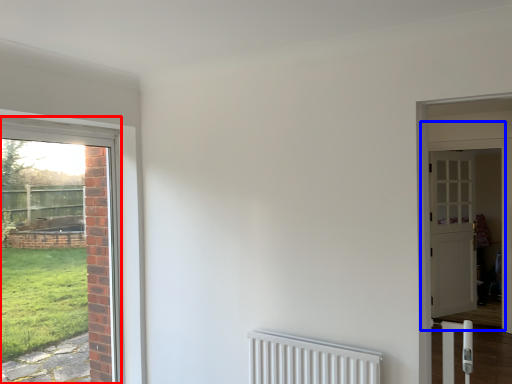
Question: Which point is further to the camera, door (highlighted by a red box) or door (highlighted by a blue box)?

Choices:
 (A) door
 (B) door

Answer: (B)